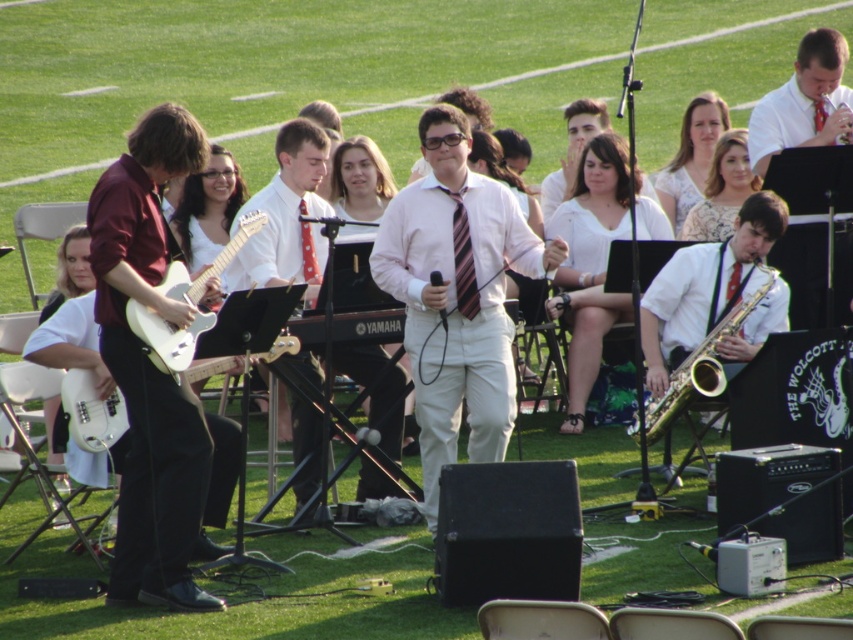
Describe the element at coordinates (804, 100) in the screenshot. I see `white shirt at upper right` at that location.

Between white shirt at upper right and gold brass saxophone at right, which one is positioned lower?

gold brass saxophone at right is lower down.

The width and height of the screenshot is (853, 640). Identify the location of white shirt at upper right. (804, 100).

Find the location of a particular element. white shirt at upper right is located at coordinates (804, 100).

Is white glossy electric guitar at left below gold brass saxophone at right?

Correct, white glossy electric guitar at left is located below gold brass saxophone at right.

Who is taller, white glossy electric guitar at left or gold brass saxophone at right?

Standing taller between the two is gold brass saxophone at right.

You are a GUI agent. You are given a task and a screenshot of the screen. Output one action in this format:
    pyautogui.click(x=<x>, y=<y>)
    Task: Click on the white glossy electric guitar at left
    The width and height of the screenshot is (853, 640).
    Given the screenshot: What is the action you would take?
    pyautogui.click(x=91, y=412)

Identify the location of white glossy electric guitar at left. The image size is (853, 640). point(91,412).

Based on the photo, is pink satin shirt at center bigger than white shirt at upper right?

Incorrect, pink satin shirt at center is not larger than white shirt at upper right.

Between pink satin shirt at center and white shirt at upper right, which one appears on the left side from the viewer's perspective?

pink satin shirt at center is more to the left.

The image size is (853, 640). Describe the element at coordinates (457, 296) in the screenshot. I see `pink satin shirt at center` at that location.

Find the location of a particular element. The height and width of the screenshot is (640, 853). pink satin shirt at center is located at coordinates (457, 296).